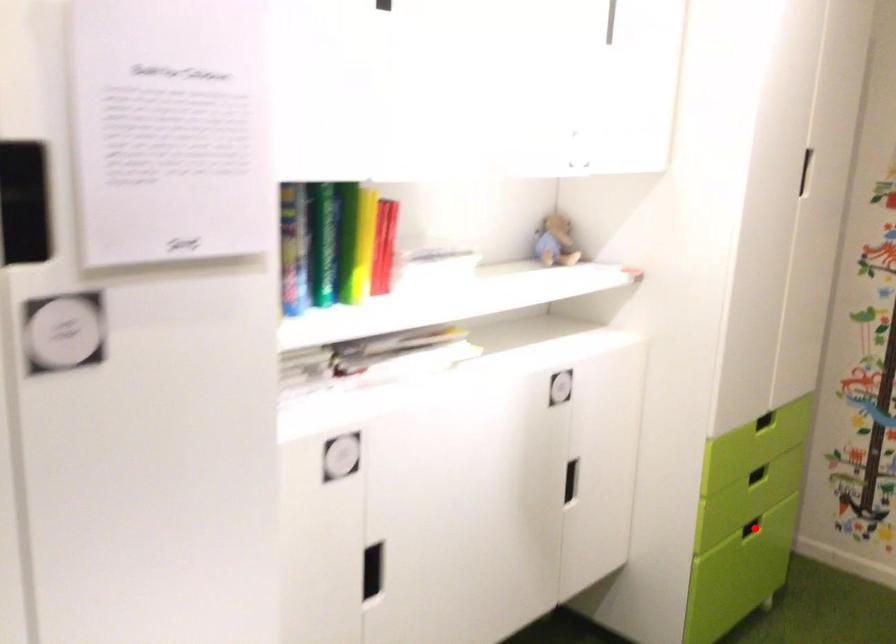
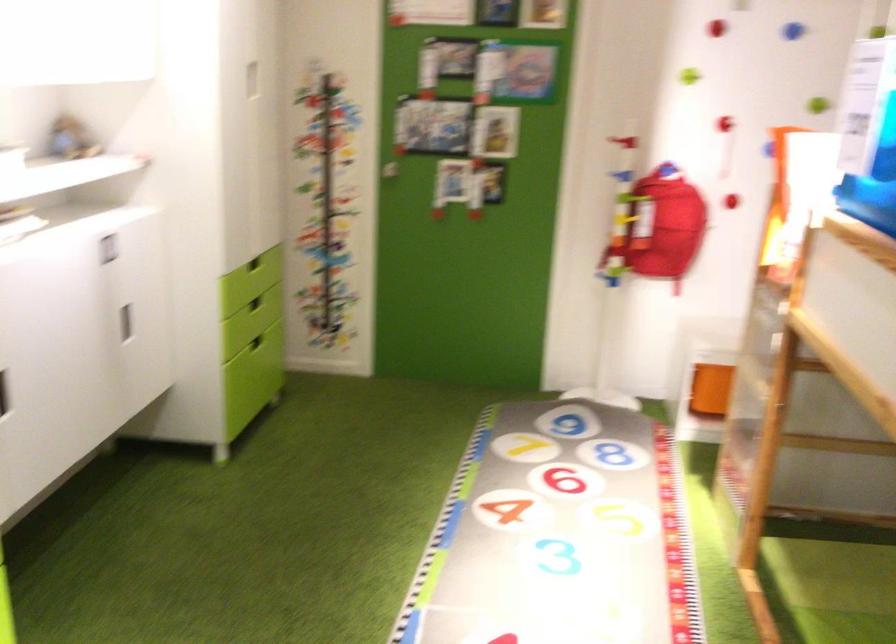
Where in the second image is the point corresponding to the highlighted location from the first image?

(255, 342)